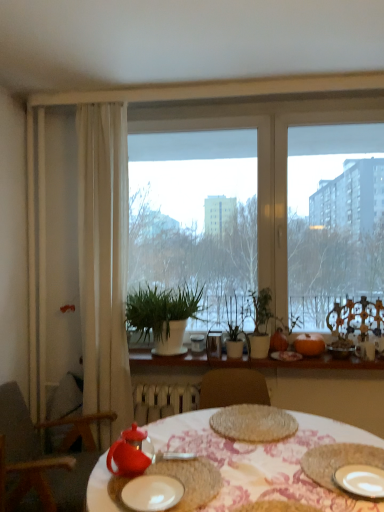
This screenshot has height=512, width=384. Identify the location of vacant region above transparent glass window at center (from a real-world perspective). (277, 109).